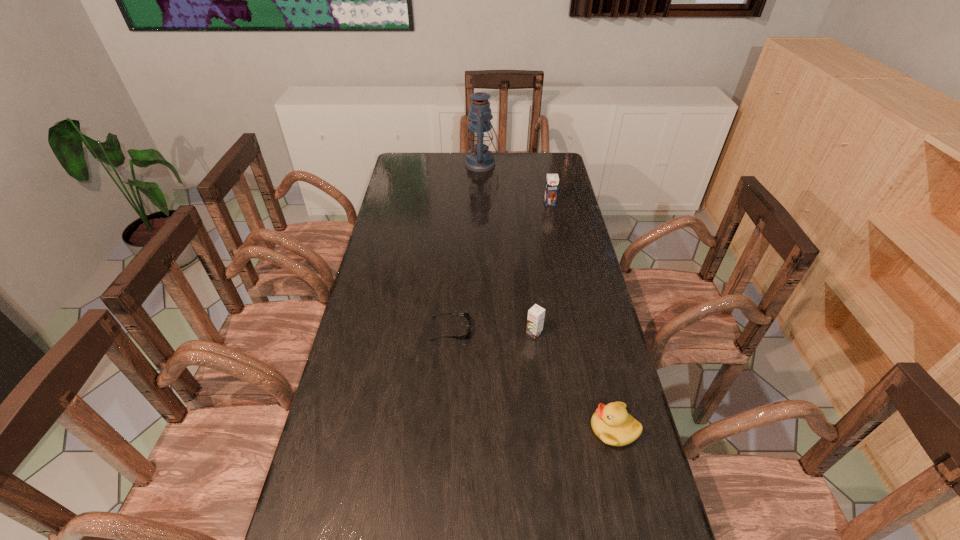
Image resolution: width=960 pixels, height=540 pixels. Identify the location of free space located on the front-facing side of the lantern. [442, 164].

The width and height of the screenshot is (960, 540). Find the location of `free region located on the front-facing side of the lantern`. free region located on the front-facing side of the lantern is located at coordinates 396,164.

Locate an element on the screen. The image size is (960, 540). vacant space located 0.300m on the front label of the right chocolate milk is located at coordinates (560, 253).

You are a GUI agent. You are given a task and a screenshot of the screen. Output one action in this format:
    pyautogui.click(x=<x>, y=<y>)
    Task: Click on the free region located on the front of the nearer chocolate milk
    The height and width of the screenshot is (540, 960).
    Given the screenshot: What is the action you would take?
    pyautogui.click(x=540, y=376)

Where is `vacant space located 0.240m on the front-facing side of the nearest object`? The height and width of the screenshot is (540, 960). vacant space located 0.240m on the front-facing side of the nearest object is located at coordinates (494, 429).

Find the location of a particular element. Image resolution: width=960 pixels, height=540 pixels. blank space located 0.210m on the front-facing side of the nearest object is located at coordinates (506, 429).

Identify the location of blank space located 0.260m on the front-facing side of the nearest object. Image resolution: width=960 pixels, height=540 pixels. (486, 429).

The width and height of the screenshot is (960, 540). In order to click on blank area located on the front-facing side of the sunglasses in this screenshot , I will do `click(511, 329)`.

Identify the location of object that is positioned at the far edge. (479, 159).

Where is `chocolate milk at the right edge`? Image resolution: width=960 pixels, height=540 pixels. chocolate milk at the right edge is located at coordinates (552, 180).